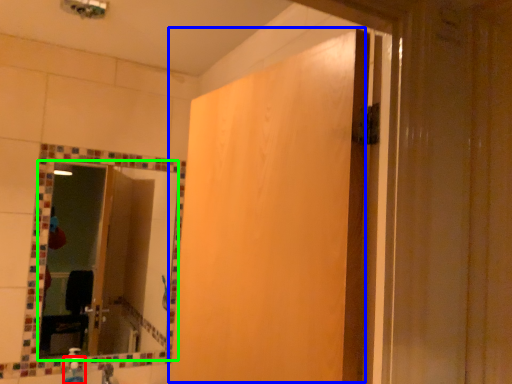
Question: Estimate the real-world distances between objects in this image. Which object is farther from soap dispenser (highlighted by a red box), screen door (highlighted by a blue box) or mirror (highlighted by a green box)?

Choices:
 (A) screen door
 (B) mirror

Answer: (A)